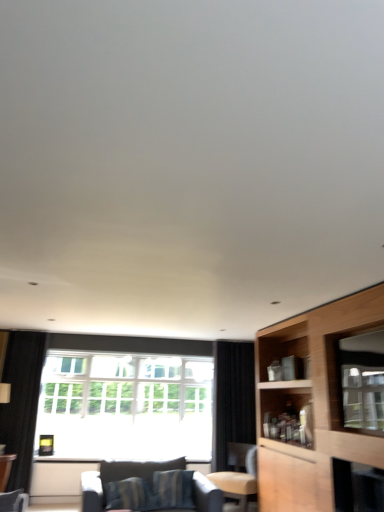
Question: Is transparent glass window screen at right at the left side of light brown leather chair at center?

Choices:
 (A) no
 (B) yes

Answer: (A)

Question: Is transparent glass window screen at right thinner than light brown leather chair at center?

Choices:
 (A) yes
 (B) no

Answer: (A)

Question: Is transparent glass window screen at right positioned beyond the bounds of light brown leather chair at center?

Choices:
 (A) yes
 (B) no

Answer: (A)

Question: Does transparent glass window screen at right have a greater width compared to light brown leather chair at center?

Choices:
 (A) no
 (B) yes

Answer: (A)

Question: Does transparent glass window screen at right come behind light brown leather chair at center?

Choices:
 (A) no
 (B) yes

Answer: (A)

Question: Is transparent glass window screen at right turned away from light brown leather chair at center?

Choices:
 (A) no
 (B) yes

Answer: (A)

Question: Would you consider clear glass window at center to be distant from black fabric curtain at center, which ranks as the 2th curtain in left-to-right order?

Choices:
 (A) no
 (B) yes

Answer: (A)

Question: Considering the relative sizes of clear glass window at center and black fabric curtain at center, which ranks as the 2th curtain in left-to-right order, in the image provided, is clear glass window at center taller than black fabric curtain at center, which ranks as the 2th curtain in left-to-right order,?

Choices:
 (A) yes
 (B) no

Answer: (B)

Question: Would you say clear glass window at center is outside black fabric curtain at center, the first curtain when ordered from right to left?

Choices:
 (A) yes
 (B) no

Answer: (A)

Question: Are clear glass window at center and black fabric curtain at center, the first curtain when ordered from right to left, beside each other?

Choices:
 (A) no
 (B) yes

Answer: (A)

Question: From a real-world perspective, is clear glass window at center beneath black fabric curtain at center, the first curtain when ordered from right to left?

Choices:
 (A) yes
 (B) no

Answer: (B)

Question: Does clear glass window at center have a larger size compared to black fabric curtain at center, the first curtain when ordered from right to left?

Choices:
 (A) no
 (B) yes

Answer: (B)

Question: From the image's perspective, is clear glass window at center on light brown leather chair at center?

Choices:
 (A) no
 (B) yes

Answer: (B)